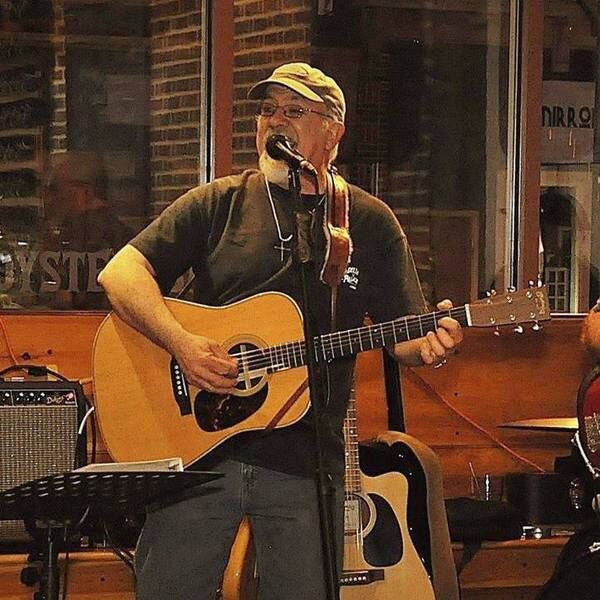
Where is `sheet stand`? The image size is (600, 600). sheet stand is located at coordinates (117, 476).